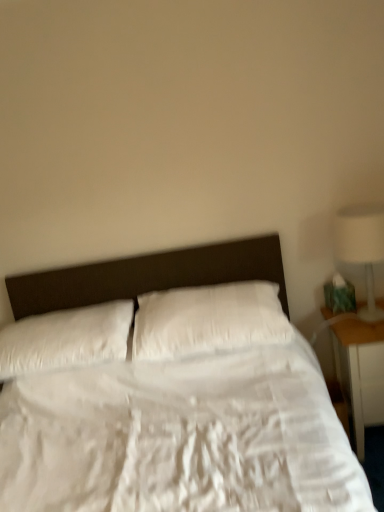
Question: Considering the relative sizes of white soft pillow at center, arranged as the second pillow when viewed from the left, and white glossy lamp at right in the image provided, is white soft pillow at center, arranged as the second pillow when viewed from the left, bigger than white glossy lamp at right?

Choices:
 (A) yes
 (B) no

Answer: (A)

Question: Can you confirm if white soft pillow at center, marked as the first pillow in a right-to-left arrangement, is smaller than white glossy lamp at right?

Choices:
 (A) yes
 (B) no

Answer: (B)

Question: Is white soft pillow at center, marked as the first pillow in a right-to-left arrangement, in contact with white glossy lamp at right?

Choices:
 (A) yes
 (B) no

Answer: (B)

Question: Is white glossy lamp at right inside white soft pillow at center, marked as the first pillow in a right-to-left arrangement?

Choices:
 (A) no
 (B) yes

Answer: (A)

Question: Is white soft pillow at center, marked as the first pillow in a right-to-left arrangement, oriented away from white glossy lamp at right?

Choices:
 (A) yes
 (B) no

Answer: (B)

Question: From the image's perspective, is wooden nightstand at right above or below white soft pillow at left, placed as the 2th pillow when sorted from right to left?

Choices:
 (A) above
 (B) below

Answer: (B)

Question: Relative to white soft pillow at left, which appears as the 1th pillow when viewed from the left, is wooden nightstand at right in front or behind?

Choices:
 (A) front
 (B) behind

Answer: (B)

Question: From a real-world perspective, is wooden nightstand at right physically located above or below white soft pillow at left, which appears as the 1th pillow when viewed from the left?

Choices:
 (A) above
 (B) below

Answer: (B)

Question: Considering the positions of wooden nightstand at right and white soft pillow at left, placed as the 2th pillow when sorted from right to left, in the image, is wooden nightstand at right bigger or smaller than white soft pillow at left, placed as the 2th pillow when sorted from right to left,?

Choices:
 (A) small
 (B) big

Answer: (B)

Question: From a real-world perspective, relative to white soft pillow at center, marked as the first pillow in a right-to-left arrangement, is white soft pillow at left, placed as the 2th pillow when sorted from right to left, vertically above or below?

Choices:
 (A) below
 (B) above

Answer: (A)

Question: Is white soft pillow at left, placed as the 2th pillow when sorted from right to left, to the left or to the right of white soft pillow at center, arranged as the second pillow when viewed from the left, in the image?

Choices:
 (A) right
 (B) left

Answer: (B)

Question: In terms of height, does white soft pillow at left, placed as the 2th pillow when sorted from right to left, look taller or shorter compared to white soft pillow at center, marked as the first pillow in a right-to-left arrangement?

Choices:
 (A) tall
 (B) short

Answer: (A)

Question: Is white soft pillow at left, placed as the 2th pillow when sorted from right to left, wider or thinner than white soft pillow at center, marked as the first pillow in a right-to-left arrangement?

Choices:
 (A) wide
 (B) thin

Answer: (A)

Question: In terms of size, does white glossy lamp at right appear bigger or smaller than white soft pillow at center, marked as the first pillow in a right-to-left arrangement?

Choices:
 (A) big
 (B) small

Answer: (B)

Question: Does point (380, 233) appear closer or farther from the camera than point (147, 317)?

Choices:
 (A) closer
 (B) farther

Answer: (A)